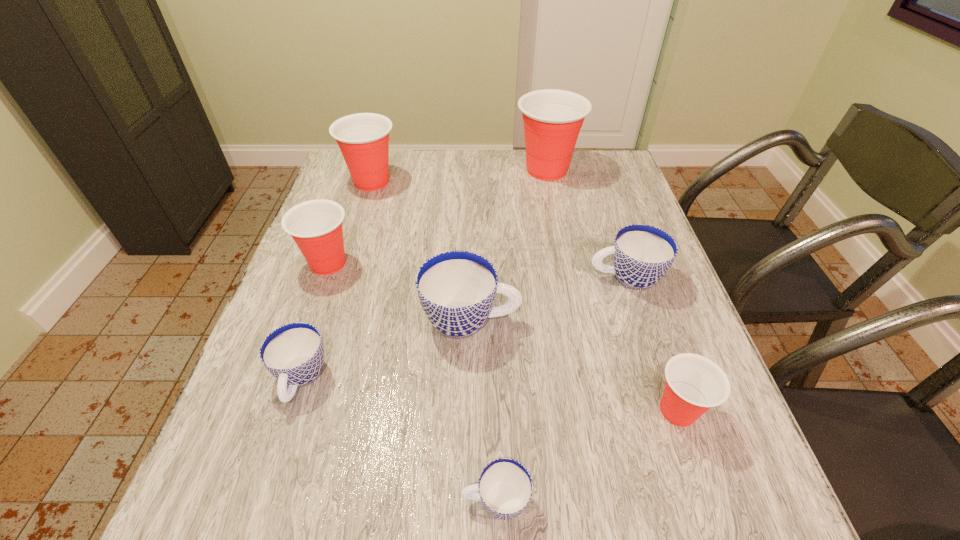
Where is `the shortest cup`? the shortest cup is located at coordinates (505, 486).

Find the location of a particular element. The height and width of the screenshot is (540, 960). the nearest blue cup is located at coordinates (505, 486).

Find the location of a particular element. blank space located 0.190m on the front of the tallest object is located at coordinates (559, 228).

At what (x,y) coordinates should I click in order to perform the action: click on vacant space located 0.210m on the right of the second tallest object. Please return your answer as a coordinate pair (x, y). Image resolution: width=960 pixels, height=540 pixels. Looking at the image, I should click on (468, 181).

The image size is (960, 540). Find the location of `vacant space situated 0.260m on the right of the third biggest red cup`. vacant space situated 0.260m on the right of the third biggest red cup is located at coordinates (461, 264).

The height and width of the screenshot is (540, 960). Find the location of `free space located on the side of the biggest blue cup with the handle`. free space located on the side of the biggest blue cup with the handle is located at coordinates (612, 320).

The width and height of the screenshot is (960, 540). I want to click on blank space located on the side of the second biggest blue cup with the handle, so click(x=567, y=277).

Identify the location of vacant space located on the side of the second biggest blue cup with the handle. This screenshot has width=960, height=540. (500, 277).

The width and height of the screenshot is (960, 540). What are the coordinates of `vacant space situated 0.400m on the side of the second biggest blue cup with the handle` in the screenshot? It's located at (421, 277).

I want to click on free space located 0.130m on the back of the nearest red cup, so click(x=651, y=332).